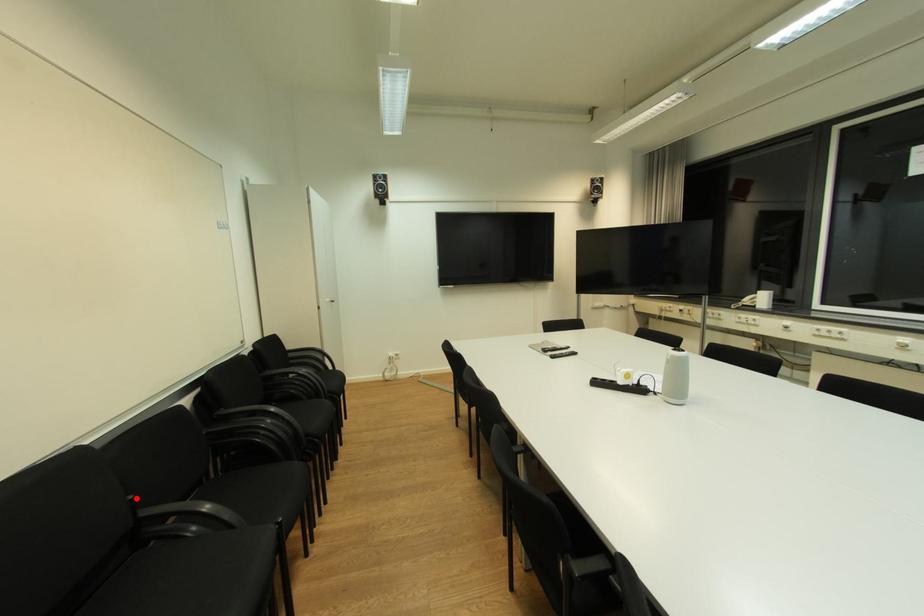
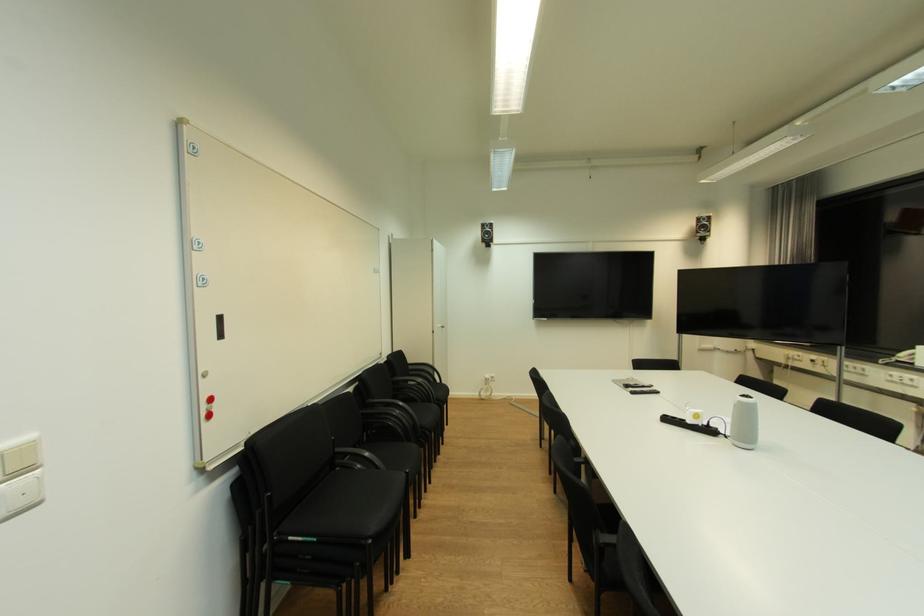
Where in the second image is the point corresponding to the highlighted location from the first image?

(338, 439)